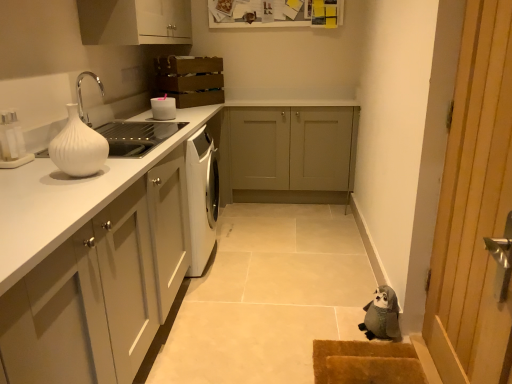
Image resolution: width=512 pixels, height=384 pixels. Find the location of `free location in front of white glossy vase at left`. free location in front of white glossy vase at left is located at coordinates (66, 187).